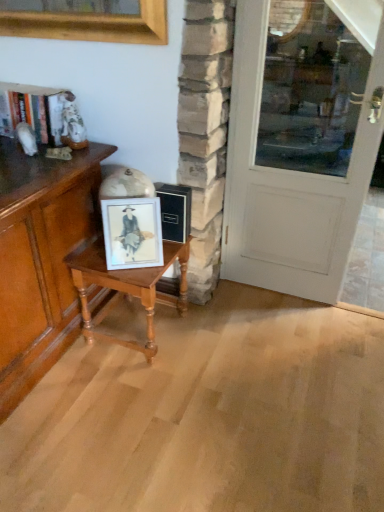
This screenshot has height=512, width=384. I want to click on free space in front of wooden table at center, so click(125, 390).